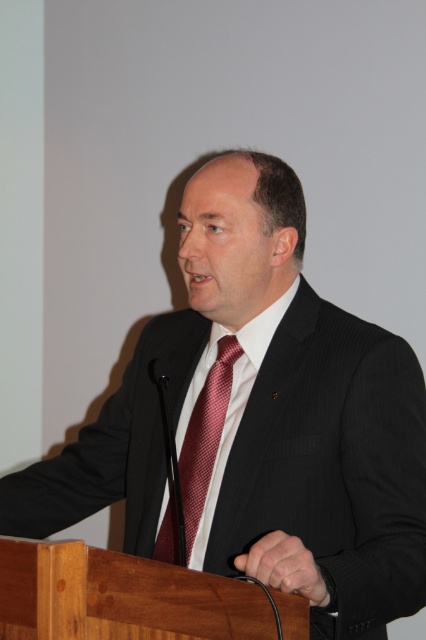
Question: Which point is closer to the camera?

Choices:
 (A) (213, 337)
 (B) (170, 506)

Answer: (B)

Question: Can you confirm if white smooth dress shirt at center is bigger than shiny red tie at center?

Choices:
 (A) no
 (B) yes

Answer: (B)

Question: Can you confirm if white smooth dress shirt at center is positioned above shiny red tie at center?

Choices:
 (A) no
 (B) yes

Answer: (B)

Question: Among these points, which one is nearest to the camera?

Choices:
 (A) (x=216, y=378)
 (B) (x=253, y=372)

Answer: (B)

Question: Is white smooth dress shirt at center thinner than shiny red tie at center?

Choices:
 (A) no
 (B) yes

Answer: (A)